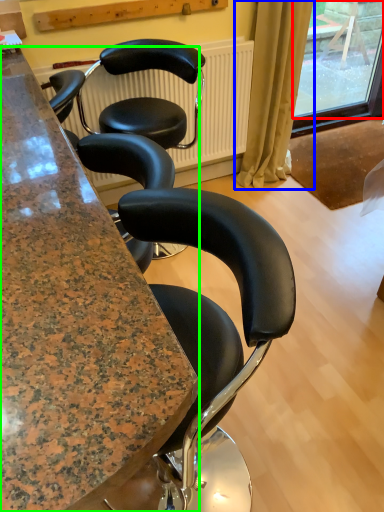
Question: Estimate the real-world distances between objects in this image. Which object is closer to window screen (highlighted by a red box), curtain (highlighted by a blue box) or cabinetry (highlighted by a green box)?

Choices:
 (A) curtain
 (B) cabinetry

Answer: (A)